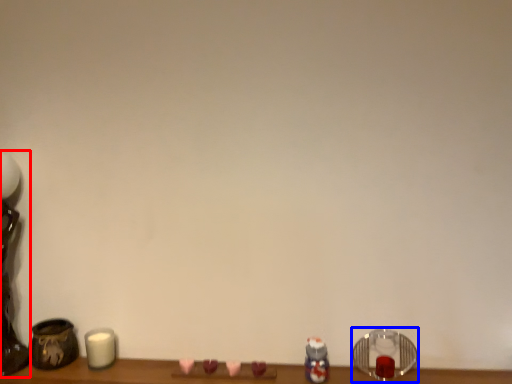
Question: Among these objects, which one is farthest to the camera, table lamp (highlighted by a red box) or candle holder (highlighted by a blue box)?

Choices:
 (A) table lamp
 (B) candle holder

Answer: (B)